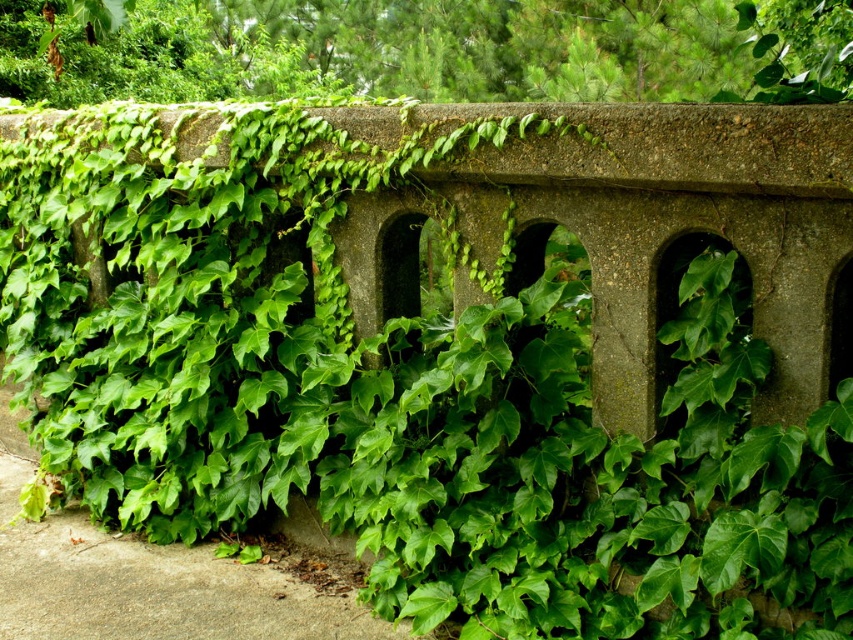
Does green leafy ivy at upper center have a greater width compared to green leafy ivy at lower left?

Incorrect, green leafy ivy at upper center's width does not surpass green leafy ivy at lower left's.

Does green leafy ivy at upper center have a lesser width compared to green leafy ivy at lower left?

Correct, green leafy ivy at upper center's width is less than green leafy ivy at lower left's.

Between point (421, 92) and point (86, 618), which one is positioned behind?

Positioned behind is point (421, 92).

Find the location of a particular element. The height and width of the screenshot is (640, 853). green leafy ivy at upper center is located at coordinates (427, 49).